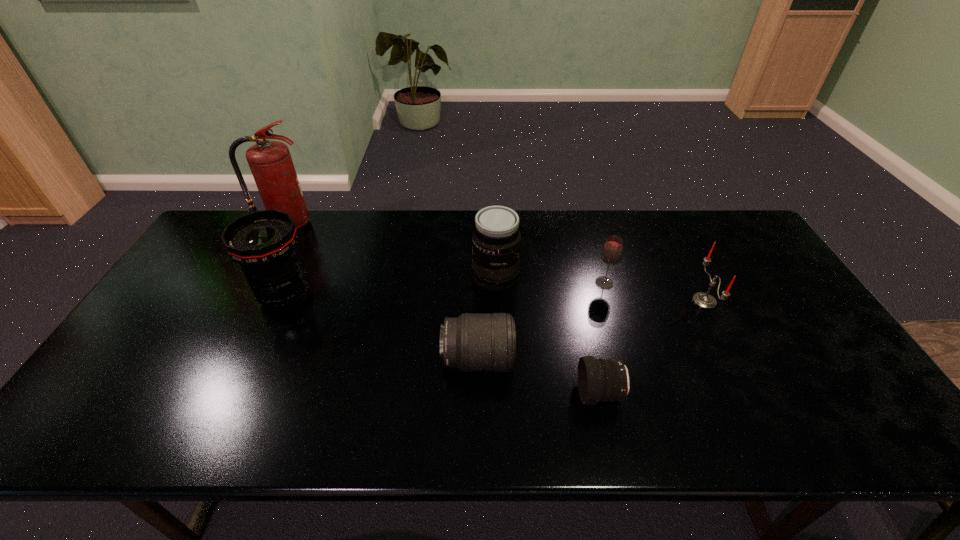
I want to click on object present at the left edge, so coord(270,162).

Image resolution: width=960 pixels, height=540 pixels. Find the location of `object that is positioned at the far left corner`. object that is positioned at the far left corner is located at coordinates (270, 162).

This screenshot has height=540, width=960. I want to click on vacant space at the far edge, so (342, 247).

Locate an element on the screen. The image size is (960, 540). vacant area at the near edge is located at coordinates (228, 439).

You are a GUI agent. You are given a task and a screenshot of the screen. Output one action in this format:
    pyautogui.click(x=<x>, y=<y>)
    Task: Click on the vacant space at the left edge of the desktop
    Image resolution: width=960 pixels, height=540 pixels.
    Given the screenshot: What is the action you would take?
    159,388

This screenshot has height=540, width=960. Find the location of `vacant space at the right edge`. vacant space at the right edge is located at coordinates (822, 389).

Identify the location of vacant space at the near right corner of the desktop. The height and width of the screenshot is (540, 960). (855, 408).

Find the location of a particular element. The height and width of the screenshot is (540, 960). vacant area between the fifth object from left to right and the second shortest telephoto lens is located at coordinates (539, 377).

Locate an element on the screen. This screenshot has height=540, width=960. vacant region between the shortest object and the candle is located at coordinates (652, 347).

What are the coordinates of `free space between the rightmost object and the glass drink container` in the screenshot? It's located at (655, 292).